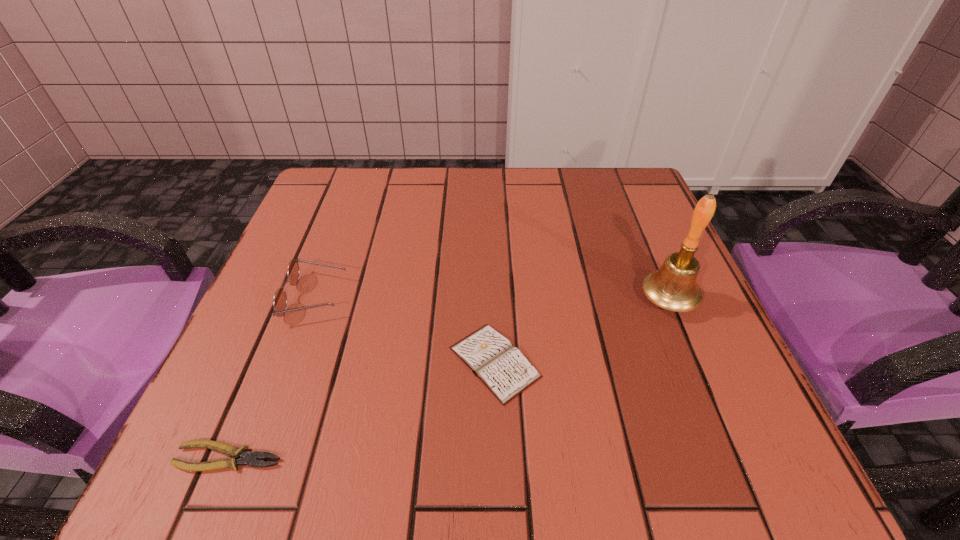
Find the location of a particular element. the tallest object is located at coordinates (673, 287).

Find the location of `bell`. bell is located at coordinates (673, 287).

The width and height of the screenshot is (960, 540). Identify the location of spectacles. (280, 299).

The width and height of the screenshot is (960, 540). I want to click on the third tallest object, so click(504, 370).

Locate an element on the screen. Image resolution: width=960 pixels, height=540 pixels. diary is located at coordinates click(x=504, y=370).

The height and width of the screenshot is (540, 960). Identify the location of the shortest object. (251, 459).

Find the location of a particular element. This screenshot has width=960, height=540. pliers is located at coordinates (251, 459).

Locate an element on the screen. The height and width of the screenshot is (540, 960). free location located 0.270m on the back of the tallest object is located at coordinates (626, 201).

I want to click on vacant position located 0.330m on the front-facing side of the second tallest object, so click(520, 297).

Identify the location of blank area located on the left of the second shortest object. point(319,362).